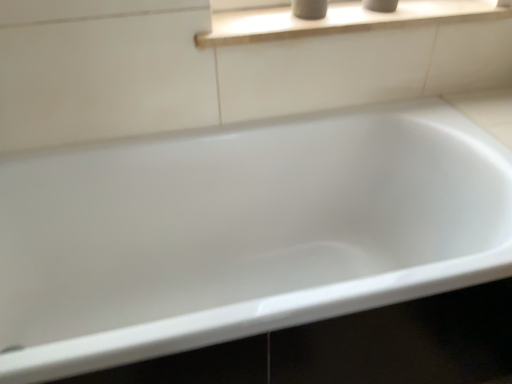
The height and width of the screenshot is (384, 512). What do you see at coordinates (341, 20) in the screenshot? I see `white ceramic window sill at upper center` at bounding box center [341, 20].

Measure the distance between white ceramic window sill at upper center and camera.

The distance of white ceramic window sill at upper center from camera is 1.09 meters.

At what (x,y) coordinates should I click in order to perform the action: click on white ceramic window sill at upper center. Please return your answer as a coordinate pair (x, y). The width and height of the screenshot is (512, 384). Looking at the image, I should click on (341, 20).

Find the location of a particular element. white ceramic window sill at upper center is located at coordinates (341, 20).